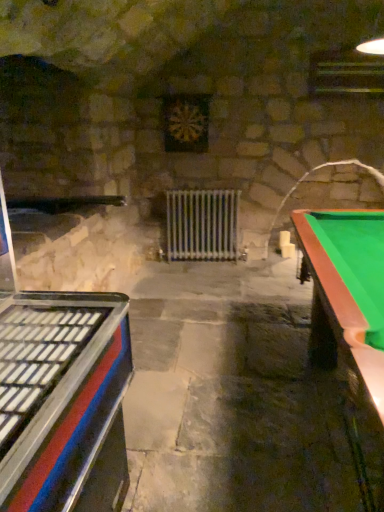
The width and height of the screenshot is (384, 512). What are the coordinates of `white metal radiator at center` in the screenshot? It's located at (202, 224).

The height and width of the screenshot is (512, 384). Describe the element at coordinates (202, 224) in the screenshot. I see `white metal radiator at center` at that location.

This screenshot has height=512, width=384. I want to click on white metal radiator at center, so click(x=202, y=224).